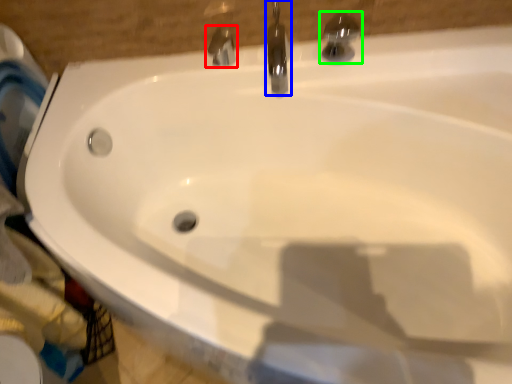
Question: Which object is positioned farthest from tap (highlighted by a red box)? Select from tap (highlighted by a blue box) and tap (highlighted by a green box).

Choices:
 (A) tap
 (B) tap

Answer: (B)